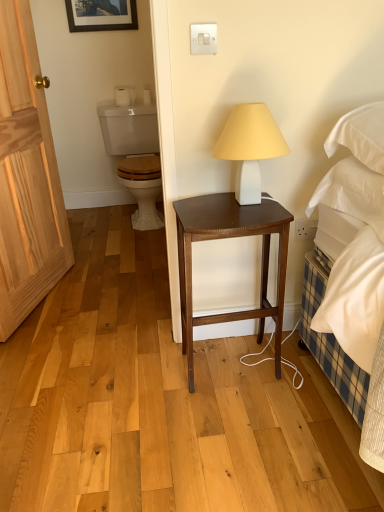
Image resolution: width=384 pixels, height=512 pixels. I want to click on free location in front of white matte lamp at center, so [248, 219].